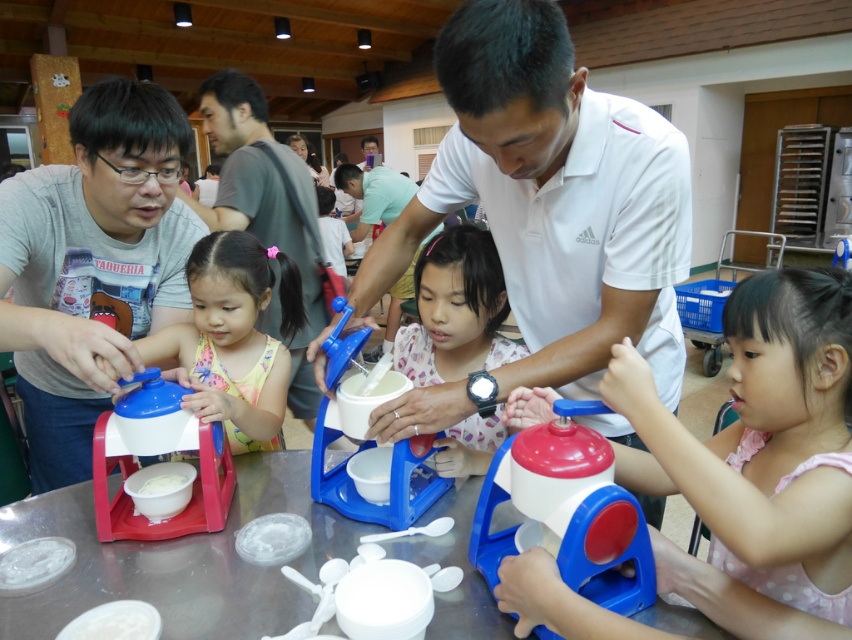
Does matte white shirt at center appear under white matte bowl at center?

No, matte white shirt at center is not below white matte bowl at center.

Is matte white shirt at center thinner than white matte bowl at center?

Incorrect, matte white shirt at center's width is not less than white matte bowl at center's.

Which is in front, point (423, 323) or point (148, 477)?

Positioned in front is point (148, 477).

Locate an element on the screen. The width and height of the screenshot is (852, 640). matte white shirt at center is located at coordinates (455, 310).

Measure the distance between smooth plastic table at center and camera.

A distance of 33.75 inches exists between smooth plastic table at center and camera.

I want to click on smooth plastic table at center, so click(x=180, y=561).

Identify the location of smooth plastic table at center. (180, 561).

Measure the distance between point (286, 618) and camera.

Point (286, 618) is 91.35 centimeters away from camera.

The height and width of the screenshot is (640, 852). Describe the element at coordinates (180, 561) in the screenshot. I see `smooth plastic table at center` at that location.

Does point (119, 557) come behind point (245, 177)?

No, (119, 557) is closer to viewer.

Locate an element on the screen. smooth plastic table at center is located at coordinates (180, 561).